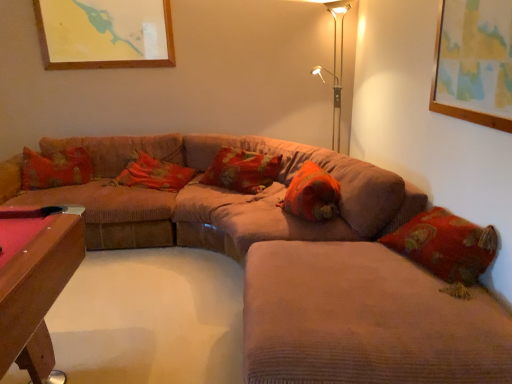
Question: Considering the relative sizes of metallic gold table lamp at upper right and corduroy couch at center, marked as the first couch in a back-to-front arrangement, in the image provided, is metallic gold table lamp at upper right smaller than corduroy couch at center, marked as the first couch in a back-to-front arrangement,?

Choices:
 (A) no
 (B) yes

Answer: (B)

Question: Considering the relative sizes of metallic gold table lamp at upper right and corduroy couch at center, marked as the first couch in a back-to-front arrangement, in the image provided, is metallic gold table lamp at upper right bigger than corduroy couch at center, marked as the first couch in a back-to-front arrangement,?

Choices:
 (A) no
 (B) yes

Answer: (A)

Question: Is metallic gold table lamp at upper right in contact with corduroy couch at center, marked as the first couch in a back-to-front arrangement?

Choices:
 (A) yes
 (B) no

Answer: (B)

Question: Is metallic gold table lamp at upper right oriented away from corduroy couch at center, which ranks as the 2th couch in front-to-back order?

Choices:
 (A) yes
 (B) no

Answer: (B)

Question: Is metallic gold table lamp at upper right not near corduroy couch at center, which ranks as the 2th couch in front-to-back order?

Choices:
 (A) yes
 (B) no

Answer: (A)

Question: Is corduroy couch at center, marked as the first couch in a back-to-front arrangement, wider or thinner than velvet beige couch at center, the first couch in the front-to-back sequence?

Choices:
 (A) wide
 (B) thin

Answer: (A)

Question: Is corduroy couch at center, which ranks as the 2th couch in front-to-back order, taller or shorter than velvet beige couch at center, the first couch in the front-to-back sequence?

Choices:
 (A) short
 (B) tall

Answer: (B)

Question: Considering the positions of point (156, 135) and point (305, 332), is point (156, 135) closer or farther from the camera than point (305, 332)?

Choices:
 (A) farther
 (B) closer

Answer: (A)

Question: From a real-world perspective, relative to velvet beige couch at center, the second couch in the back-to-front sequence, is corduroy couch at center, which ranks as the 2th couch in front-to-back order, vertically above or below?

Choices:
 (A) below
 (B) above

Answer: (B)

Question: From a real-world perspective, relative to metallic gold table lamp at upper right, is floral fabric pillow at center, which is counted as the 2th pillow, starting from the left, vertically above or below?

Choices:
 (A) below
 (B) above

Answer: (A)

Question: In terms of width, does floral fabric pillow at center, marked as the second pillow in a right-to-left arrangement, look wider or thinner when compared to metallic gold table lamp at upper right?

Choices:
 (A) thin
 (B) wide

Answer: (A)

Question: From the image's perspective, relative to metallic gold table lamp at upper right, is floral fabric pillow at center, marked as the second pillow in a right-to-left arrangement, above or below?

Choices:
 (A) below
 (B) above

Answer: (A)

Question: Considering the positions of floral fabric pillow at center, marked as the second pillow in a right-to-left arrangement, and metallic gold table lamp at upper right in the image, is floral fabric pillow at center, marked as the second pillow in a right-to-left arrangement, taller or shorter than metallic gold table lamp at upper right?

Choices:
 (A) short
 (B) tall

Answer: (A)

Question: Choose the correct answer: Is velvet beige couch at center, the first couch in the front-to-back sequence, inside velvet floral pillow at center, the third pillow positioned from the right, or outside it?

Choices:
 (A) outside
 (B) inside

Answer: (A)

Question: Is velvet beige couch at center, the first couch in the front-to-back sequence, in front of or behind velvet floral pillow at center, the third pillow positioned from the right, in the image?

Choices:
 (A) front
 (B) behind

Answer: (A)